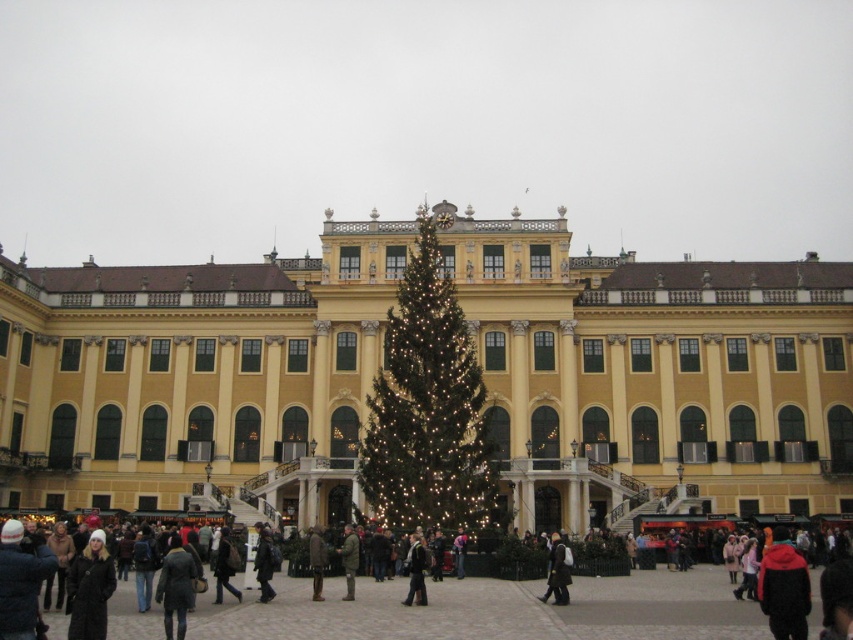
Question: Can you confirm if green textured christmas tree at center is smaller than brown wool coat at center?

Choices:
 (A) no
 (B) yes

Answer: (A)

Question: Can you confirm if yellow matte building at center is positioned to the left of camouflage jacket at center?

Choices:
 (A) no
 (B) yes

Answer: (A)

Question: Which object is farther from the camera taking this photo?

Choices:
 (A) green textured christmas tree at center
 (B) red fleece jacket at lower right
 (C) yellow matte building at center

Answer: (C)

Question: Which point appears closest to the camera in this image?

Choices:
 (A) (x=720, y=598)
 (B) (x=310, y=566)

Answer: (A)

Question: Which object is farther from the camera taking this photo?

Choices:
 (A) brown wool coat at center
 (B) dark gray wool coat at center
 (C) camouflage jacket at center

Answer: (C)

Question: Does dark gray coat at center come behind brown wool coat at center?

Choices:
 (A) no
 (B) yes

Answer: (A)